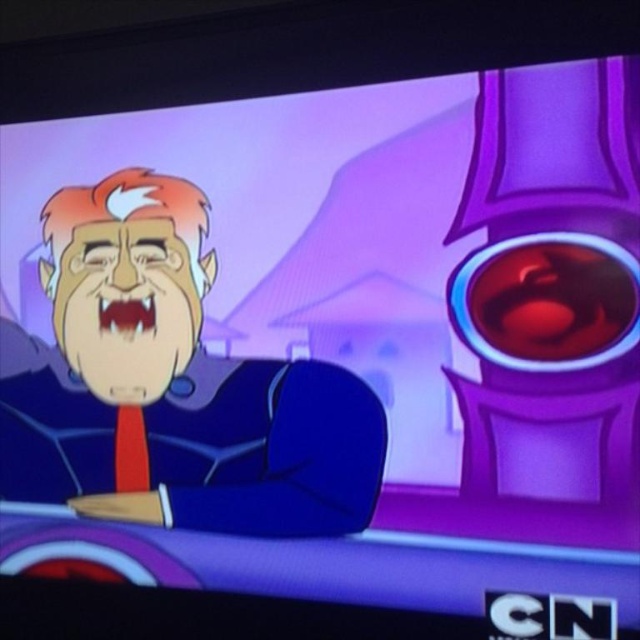
You are a costume designer preparing to create a replica of the character from the animated show. You need to position the matte black suit at left and the red matte tie at lower left correctly. Based on the scene description, which object should be placed higher when assembling the costume?

The matte black suit at left should be placed higher than the red matte tie at lower left because the matte black suit at left is located above the red matte tie at lower left in the scene.

You are a costume designer preparing for a scene where the character in the matte black suit at left and the red matte tie at lower left need to be positioned. Based on the image, which object is closer to the camera?

The matte black suit at left is closer to the viewer than the red matte tie at lower left.